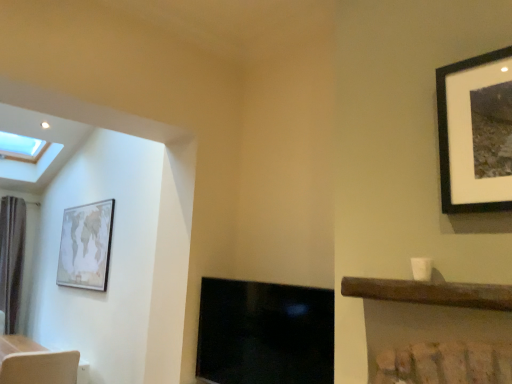
The image size is (512, 384). Find the location of `light brown textured swivel chair at lower left`. light brown textured swivel chair at lower left is located at coordinates (40, 368).

The width and height of the screenshot is (512, 384). What are the coordinates of `black glossy fireplace at center` in the screenshot? It's located at (265, 333).

This screenshot has height=384, width=512. What are the coordinates of `light brown textured swivel chair at lower left` in the screenshot? It's located at (40, 368).

Is light brown textured swivel chair at lower left wider than dark brown fabric curtain at left?

Yes.

Choose the correct answer: Is light brown textured swivel chair at lower left inside dark brown fabric curtain at left or outside it?

The correct answer is: outside.

In the image, is light brown textured swivel chair at lower left positioned in front of or behind dark brown fabric curtain at left?

light brown textured swivel chair at lower left is in front of dark brown fabric curtain at left.

Based on their sizes in the image, would you say light brown textured swivel chair at lower left is bigger or smaller than black glossy fireplace at center?

In the image, light brown textured swivel chair at lower left appears to be larger than black glossy fireplace at center.

Can you confirm if light brown textured swivel chair at lower left is taller than black glossy fireplace at center?

Incorrect, the height of light brown textured swivel chair at lower left is not larger of that of black glossy fireplace at center.

Where is `fireplace that is on the right side of light brown textured swivel chair at lower left`? fireplace that is on the right side of light brown textured swivel chair at lower left is located at coordinates (265, 333).

Is light brown textured swivel chair at lower left not inside black glossy fireplace at center?

light brown textured swivel chair at lower left is positioned outside black glossy fireplace at center.

From the image's perspective, does light brown textured swivel chair at lower left appear higher than matte wooden map at left?

Incorrect, from the image's perspective, light brown textured swivel chair at lower left is lower than matte wooden map at left.

Is light brown textured swivel chair at lower left in contact with matte wooden map at left?

light brown textured swivel chair at lower left and matte wooden map at left are not in contact.

Considering the sizes of objects light brown textured swivel chair at lower left and matte wooden map at left in the image provided, who is bigger, light brown textured swivel chair at lower left or matte wooden map at left?

light brown textured swivel chair at lower left is bigger.

Between light brown textured swivel chair at lower left and matte wooden map at left, which one has less height?

light brown textured swivel chair at lower left.

In terms of size, does matte wooden map at left appear bigger or smaller than dark brown fabric curtain at left?

Clearly, matte wooden map at left is smaller in size than dark brown fabric curtain at left.

Which object is closer to the camera taking this photo, matte wooden map at left or dark brown fabric curtain at left?

matte wooden map at left is in front.

Does matte wooden map at left have a lesser height compared to dark brown fabric curtain at left?

Correct, matte wooden map at left is not as tall as dark brown fabric curtain at left.

Are black glossy fireplace at center and light brown textured swivel chair at lower left beside each other?

They are not placed beside each other.

This screenshot has width=512, height=384. Find the location of `swivel chair on the left of black glossy fireplace at center`. swivel chair on the left of black glossy fireplace at center is located at coordinates (40, 368).

Is black glossy fireplace at center facing towards light brown textured swivel chair at lower left?

No, black glossy fireplace at center is not oriented towards light brown textured swivel chair at lower left.

From the image's perspective, is black glossy fireplace at center positioned above or below light brown textured swivel chair at lower left?

Based on their image positions, black glossy fireplace at center is located above light brown textured swivel chair at lower left.

Is black glossy fireplace at center behind dark brown fabric curtain at left?

No, the depth of black glossy fireplace at center is less than that of dark brown fabric curtain at left.

Is black glossy fireplace at center next to dark brown fabric curtain at left and touching it?

No, black glossy fireplace at center is not making contact with dark brown fabric curtain at left.

Choose the correct answer: Is black glossy fireplace at center inside dark brown fabric curtain at left or outside it?

The correct answer is: outside.

You are a GUI agent. You are given a task and a screenshot of the screen. Output one action in this format:
    pyautogui.click(x=<x>, y=<y>)
    Task: Click on the fireplace that is on the right side of dark brown fabric curtain at left
    Image resolution: width=512 pixels, height=384 pixels.
    Given the screenshot: What is the action you would take?
    pyautogui.click(x=265, y=333)

Does dark brown fabric curtain at left have a greater width compared to black glossy fireplace at center?

Correct, the width of dark brown fabric curtain at left exceeds that of black glossy fireplace at center.

At what (x,y) coordinates should I click in order to perform the action: click on fireplace in front of the dark brown fabric curtain at left. Please return your answer as a coordinate pair (x, y). This screenshot has height=384, width=512. Looking at the image, I should click on (265, 333).

Does dark brown fabric curtain at left have a greater height compared to black glossy fireplace at center?

Yes.

Is dark brown fabric curtain at left positioned with its back to black glossy fireplace at center?

No.

You are a GUI agent. You are given a task and a screenshot of the screen. Output one action in this format:
    pyautogui.click(x=<x>, y=<y>)
    Task: Click on the curtain lying above the light brown textured swivel chair at lower left (from the image's perspective)
    The height and width of the screenshot is (384, 512).
    Given the screenshot: What is the action you would take?
    pyautogui.click(x=11, y=258)

I want to click on fireplace on the right of light brown textured swivel chair at lower left, so click(x=265, y=333).

When comparing their distances from matte wooden map at left, does light brown textured swivel chair at lower left or dark brown fabric curtain at left seem closer?

Among the two, light brown textured swivel chair at lower left is located nearer to matte wooden map at left.

Based on their spatial positions, is matte wooden map at left or black glossy fireplace at center closer to dark brown fabric curtain at left?

matte wooden map at left.

Estimate the real-world distances between objects in this image. Which object is further from black glossy fireplace at center, matte wooden map at left or light brown textured swivel chair at lower left?

Among the two, matte wooden map at left is located further to black glossy fireplace at center.

Looking at the image, which one is located closer to light brown textured swivel chair at lower left, dark brown fabric curtain at left or matte wooden map at left?

matte wooden map at left is closer to light brown textured swivel chair at lower left.

Based on their spatial positions, is black glossy fireplace at center or light brown textured swivel chair at lower left closer to dark brown fabric curtain at left?

light brown textured swivel chair at lower left is closer to dark brown fabric curtain at left.

Looking at the image, which one is located closer to black glossy fireplace at center, light brown textured swivel chair at lower left or dark brown fabric curtain at left?

light brown textured swivel chair at lower left lies closer to black glossy fireplace at center than the other object.

Based on the photo, based on their spatial positions, is dark brown fabric curtain at left or light brown textured swivel chair at lower left closer to black glossy fireplace at center?

light brown textured swivel chair at lower left lies closer to black glossy fireplace at center than the other object.

Considering their positions, is light brown textured swivel chair at lower left positioned further to matte wooden map at left than black glossy fireplace at center?

black glossy fireplace at center lies further to matte wooden map at left than the other object.

I want to click on picture frame between light brown textured swivel chair at lower left and black glossy fireplace at center from left to right, so click(x=86, y=246).

The height and width of the screenshot is (384, 512). Identify the location of picture frame between black glossy fireplace at center and dark brown fabric curtain at left from front to back. (86, 246).

The image size is (512, 384). Identify the location of picture frame between light brown textured swivel chair at lower left and dark brown fabric curtain at left from front to back. (86, 246).

The width and height of the screenshot is (512, 384). I want to click on swivel chair situated between dark brown fabric curtain at left and black glossy fireplace at center from left to right, so click(x=40, y=368).